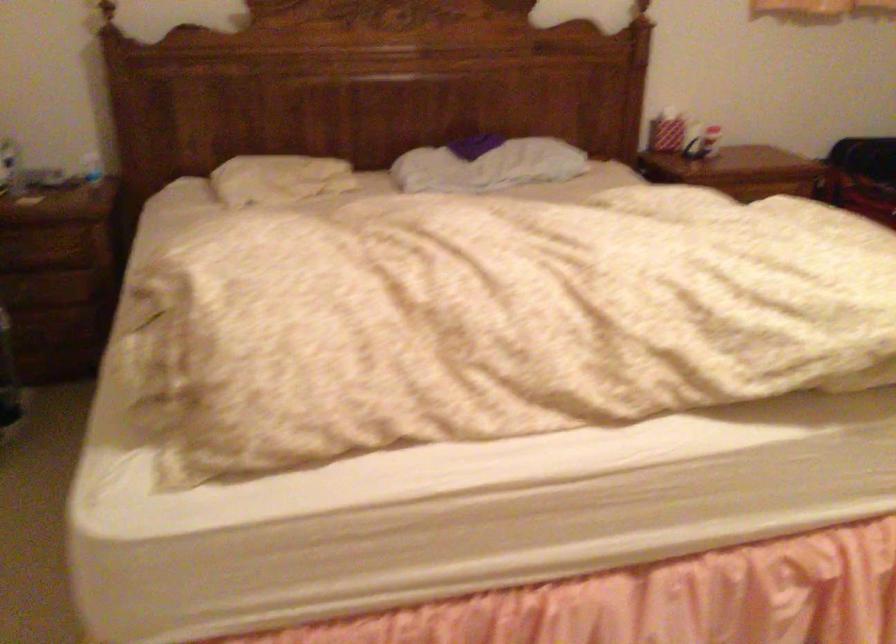
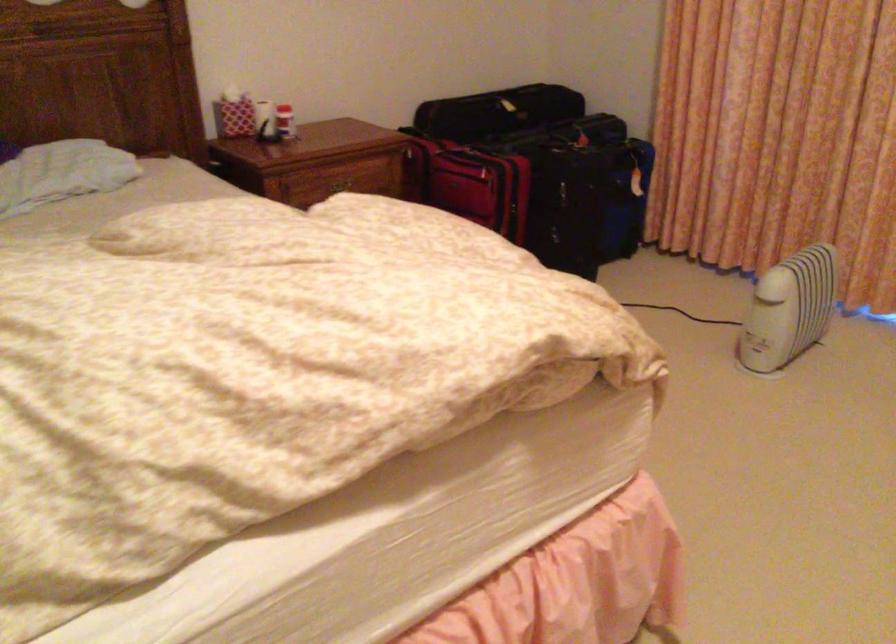
Locate, in the second image, the point that corresponds to pixel 713 129 in the first image.

(285, 122)